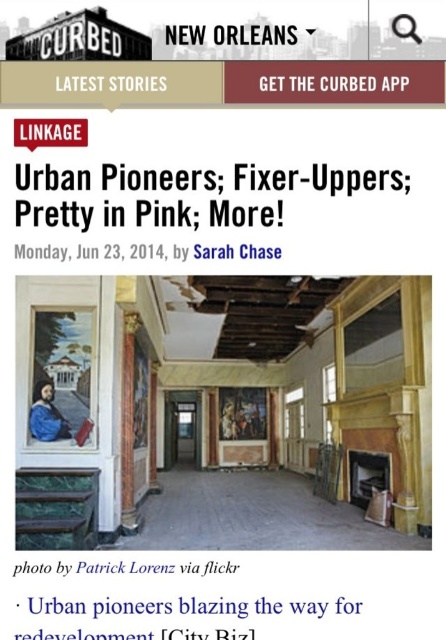
Does white paper at center have a smaller size compared to matte black text at upper center?

Actually, white paper at center might be larger than matte black text at upper center.

Can you confirm if white paper at center is positioned below matte black text at upper center?

Yes.

The image size is (446, 640). I want to click on white paper at center, so click(x=211, y=605).